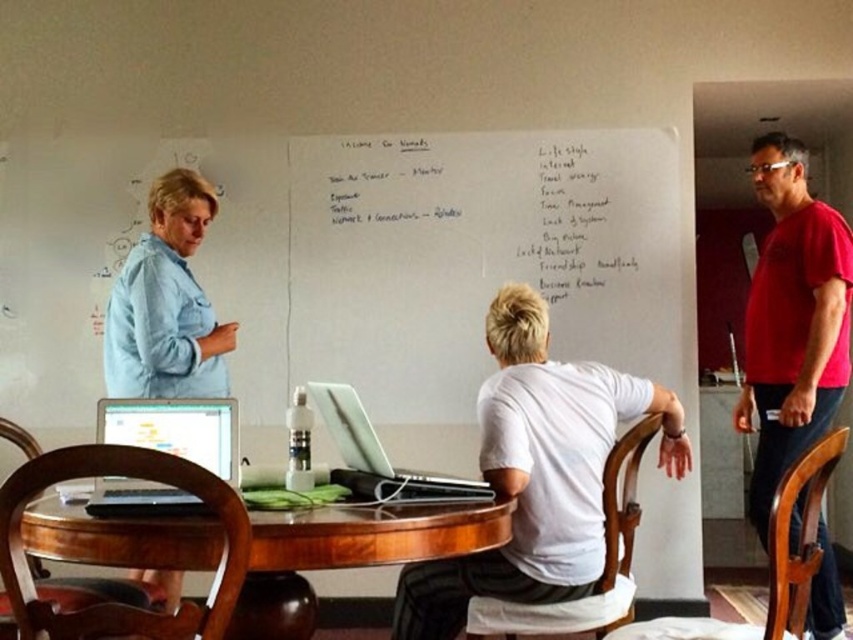
You are organizing a meeting and need to place a 12 inch ruler on the table. Given the white handwritten notes at center and the matte black laptop at lower left, which object can the ruler fit next to without overlapping?

The white handwritten notes at center has a larger width than the matte black laptop at lower left, so the ruler can fit next to the white handwritten notes at center without overlapping.

You are a participant in the discussion and need to refer to the white handwritten notes at center and the matte black laptop at lower left. Which object is closer to you?

The white handwritten notes at center are closer to you because the matte black laptop at lower left is behind them.